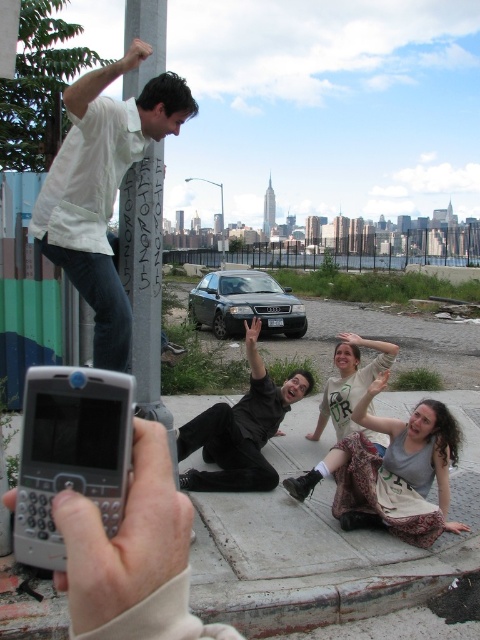
Does black matte suit at center come behind white cotton shirt at center?

No, black matte suit at center is in front of white cotton shirt at center.

Is black matte suit at center bigger than white cotton shirt at center?

Correct, black matte suit at center is larger in size than white cotton shirt at center.

Describe the element at coordinates (240, 428) in the screenshot. I see `black matte suit at center` at that location.

Locate an element on the screen. This screenshot has width=480, height=640. black matte suit at center is located at coordinates (x=240, y=428).

Who is higher up, white painted metal pole at upper left or black matte suit at center?

white painted metal pole at upper left is higher up.

Is white painted metal pole at upper left shorter than black matte suit at center?

No.

Is point (169, 440) positioned in front of point (240, 400)?

Yes.

The image size is (480, 640). In order to click on white painted metal pole at upper left in this screenshot , I will do `click(144, 280)`.

Does white matte shirt at upper left appear on the left side of white painted metal pole at upper left?

Incorrect, white matte shirt at upper left is not on the left side of white painted metal pole at upper left.

Can you confirm if white matte shirt at upper left is taller than white painted metal pole at upper left?

No.

The height and width of the screenshot is (640, 480). What do you see at coordinates (103, 188) in the screenshot?
I see `white matte shirt at upper left` at bounding box center [103, 188].

This screenshot has height=640, width=480. I want to click on white matte shirt at upper left, so (103, 188).